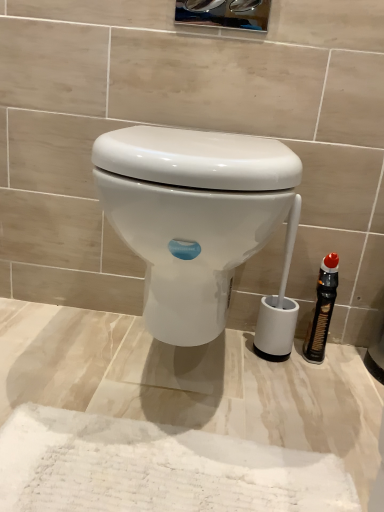
Question: From the image's perspective, is black plastic bottle at right above or below white glossy toilet at center?

Choices:
 (A) above
 (B) below

Answer: (B)

Question: Is black plastic bottle at right spatially inside white glossy toilet at center, or outside of it?

Choices:
 (A) outside
 (B) inside

Answer: (A)

Question: Relative to white glossy toilet at center, is black plastic bottle at right in front or behind?

Choices:
 (A) behind
 (B) front

Answer: (A)

Question: From a real-world perspective, is white glossy toilet at center positioned above or below black plastic bottle at right?

Choices:
 (A) below
 (B) above

Answer: (B)

Question: From the image's perspective, is white glossy toilet at center positioned above or below black plastic bottle at right?

Choices:
 (A) above
 (B) below

Answer: (A)

Question: Which is correct: white glossy toilet at center is inside black plastic bottle at right, or outside of it?

Choices:
 (A) outside
 (B) inside

Answer: (A)

Question: In the image, is white glossy toilet at center on the left side or the right side of black plastic bottle at right?

Choices:
 (A) left
 (B) right

Answer: (A)